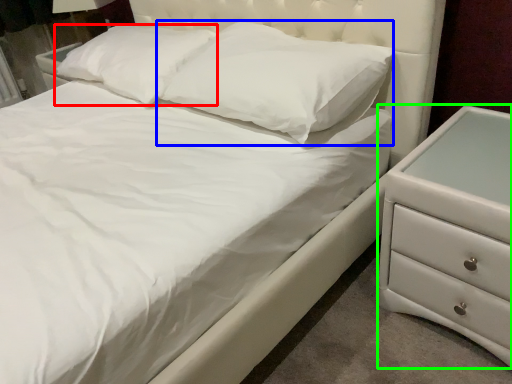
Question: Considering the real-world distances, which object is closest to pillow (highlighted by a red box)? pillow (highlighted by a blue box) or chest of drawers (highlighted by a green box).

Choices:
 (A) pillow
 (B) chest of drawers

Answer: (A)